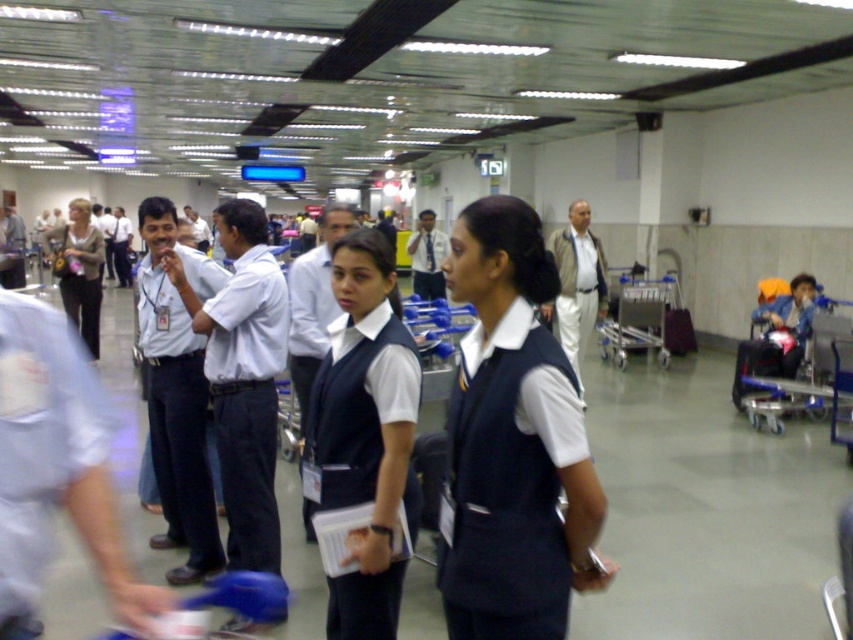
Is navy blue vest at center below light blue fabric shirt at left?

Incorrect, navy blue vest at center is not positioned below light blue fabric shirt at left.

Which is behind, point (358, 291) or point (202, 435)?

The point (202, 435) is more distant.

Locate an element on the screen. navy blue vest at center is located at coordinates (364, 433).

Can you confirm if navy blue fabric vest at center is taller than white fabric shirt at center?

In fact, navy blue fabric vest at center may be shorter than white fabric shirt at center.

Which is above, navy blue fabric vest at center or white fabric shirt at center?

Positioned higher is navy blue fabric vest at center.

The width and height of the screenshot is (853, 640). What do you see at coordinates (508, 483) in the screenshot?
I see `navy blue fabric vest at center` at bounding box center [508, 483].

Where is `navy blue fabric vest at center`? The image size is (853, 640). navy blue fabric vest at center is located at coordinates (508, 483).

Is navy blue vest at center smaller than white fabric shirt at center?

Incorrect, navy blue vest at center is not smaller in size than white fabric shirt at center.

Is navy blue vest at center in front of white fabric shirt at center?

That is True.

Between point (379, 502) and point (277, 536), which one is positioned in front?

Point (379, 502)

Locate an element on the screen. The height and width of the screenshot is (640, 853). navy blue vest at center is located at coordinates (364, 433).